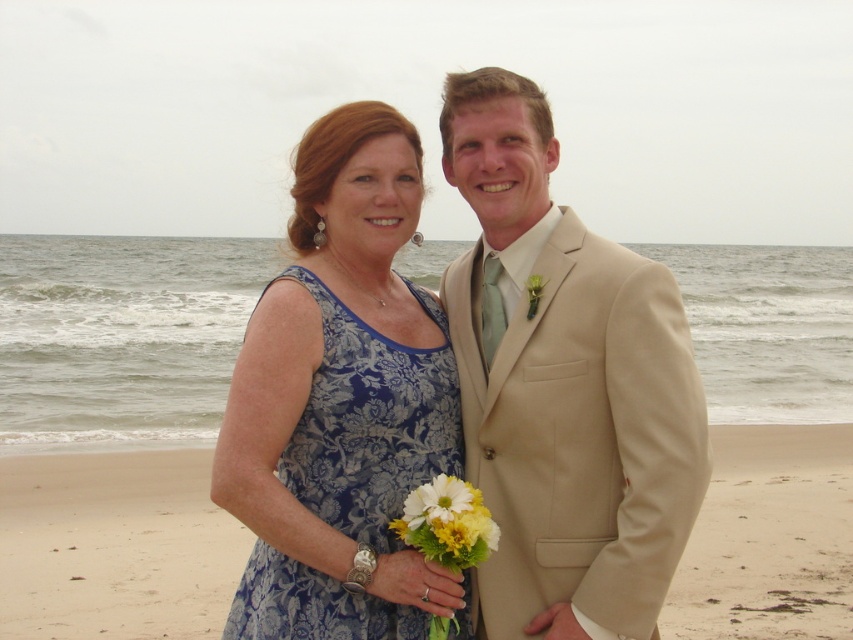
Is point (465, 324) positioned in front of point (432, 628)?

No, it is behind (432, 628).

Between beige suit at center and white/yellow fabric bouquet at center, which one appears on the left side from the viewer's perspective?

white/yellow fabric bouquet at center is more to the left.

The width and height of the screenshot is (853, 640). Find the location of `beige suit at center`. beige suit at center is located at coordinates (564, 385).

Does beige sand at lower center appear under white/yellow fabric bouquet at center?

Correct, beige sand at lower center is located below white/yellow fabric bouquet at center.

Is beige sand at lower center above white/yellow fabric bouquet at center?

No, beige sand at lower center is not above white/yellow fabric bouquet at center.

Between point (735, 525) and point (450, 618), which one is positioned in front?

Point (450, 618) is in front.

Find the location of `beige sand at lower center`. beige sand at lower center is located at coordinates (114, 547).

Consider the image. Is blue damask dress at center smaller than white/yellow fabric bouquet at center?

No, blue damask dress at center is not smaller than white/yellow fabric bouquet at center.

Identify the location of blue damask dress at center. The image size is (853, 640). tap(370, 420).